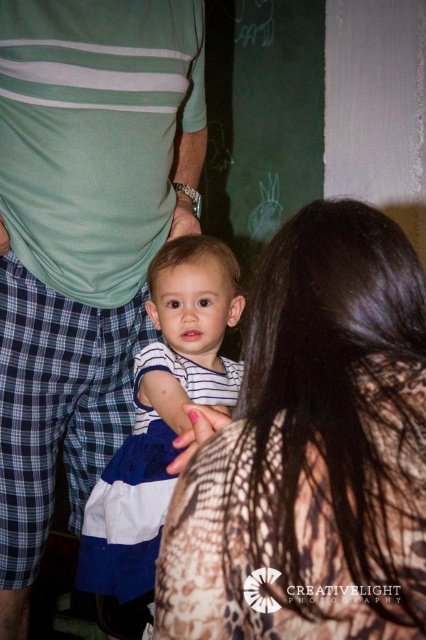
Who is positioned more to the right, brown textured dress at center or green striped shirt at center?

Positioned to the right is brown textured dress at center.

Does brown textured dress at center have a larger size compared to green striped shirt at center?

No.

Is point (284, 568) more distant than point (178, 177)?

No, it is in front of (178, 177).

You are a GUI agent. You are given a task and a screenshot of the screen. Output one action in this format:
    pyautogui.click(x=<x>, y=<y>)
    Task: Click on the brown textured dress at center
    
    Given the screenshot: What is the action you would take?
    pyautogui.click(x=313, y=451)

Is green striped shirt at center to the right of white striped shirt at center from the viewer's perspective?

Incorrect, green striped shirt at center is not on the right side of white striped shirt at center.

What do you see at coordinates (81, 237) in the screenshot? I see `green striped shirt at center` at bounding box center [81, 237].

Is point (34, 522) positioned behind point (123, 541)?

Yes, point (34, 522) is farther from viewer.

Locate an element on the screen. The height and width of the screenshot is (640, 426). green striped shirt at center is located at coordinates (81, 237).

Does white striped shirt at center have a greater width compared to matte skin hand at center?

Yes.

Which is more to the right, white striped shirt at center or matte skin hand at center?

matte skin hand at center is more to the right.

Is point (204, 282) closer to camera compared to point (189, 227)?

That is True.

Where is `white striped shirt at center`? Image resolution: width=426 pixels, height=640 pixels. white striped shirt at center is located at coordinates click(161, 413).